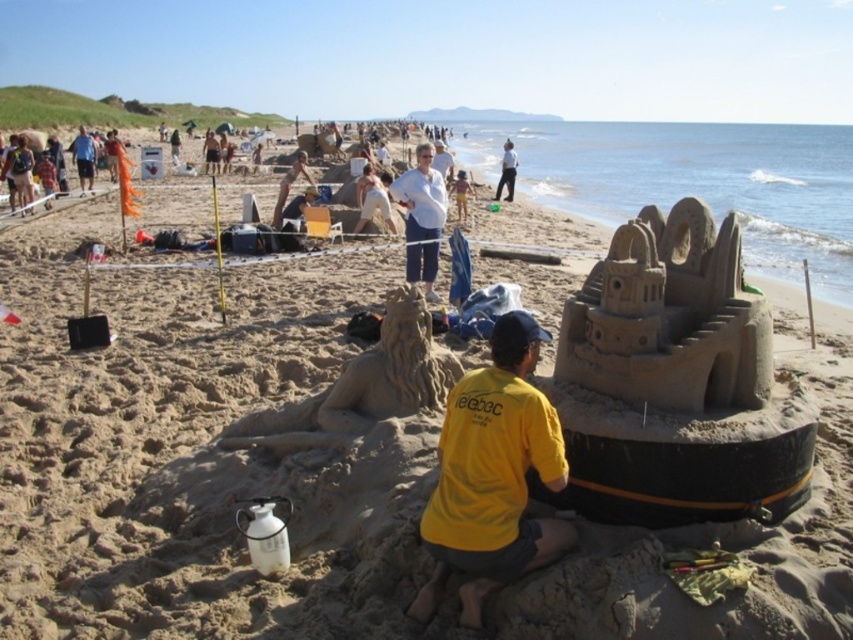
Question: Is white cotton shirt at center thinner than light blue denim shorts at center?

Choices:
 (A) yes
 (B) no

Answer: (B)

Question: Can you confirm if white cotton shirt at center is positioned above light blue denim shorts at center?

Choices:
 (A) no
 (B) yes

Answer: (A)

Question: Which point is farther to the camera?

Choices:
 (A) white cotton shirt at upper center
 (B) light brown sandcastle at center
 (C) yellow fabric shirt at lower center

Answer: (B)

Question: From the image, what is the correct spatial relationship of smooth sand lion at center in relation to light brown sandcastle at center?

Choices:
 (A) below
 (B) above

Answer: (A)

Question: Considering the real-world distances, which object is closest to the light blue denim shorts at center?

Choices:
 (A) light brown sandcastle at center
 (B) sandcastle at right
 (C) yellow fabric shirt at lower center
 (D) smooth sand lion at center

Answer: (D)

Question: Which point is closer to the camera?

Choices:
 (A) light brown sandcastle at center
 (B) white cotton shirt at upper center
 (C) white cotton shirt at center

Answer: (C)